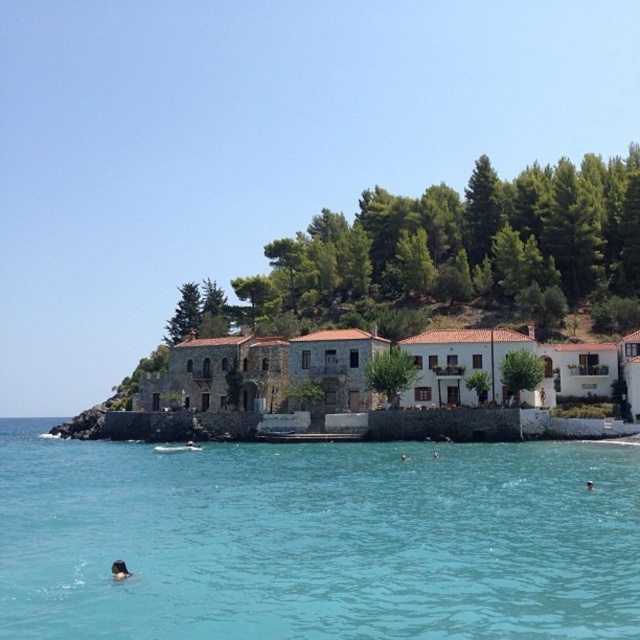
Which is above, black matte person at lower left or brown hair at lower center?

Positioned higher is brown hair at lower center.

Does black matte person at lower left appear on the right side of brown hair at lower center?

No, black matte person at lower left is not to the right of brown hair at lower center.

This screenshot has width=640, height=640. What do you see at coordinates (120, 570) in the screenshot?
I see `black matte person at lower left` at bounding box center [120, 570].

The image size is (640, 640). Find the location of `black matte person at lower left`. black matte person at lower left is located at coordinates (120, 570).

Is point (116, 502) positioned before point (131, 572)?

No.

Is clear blue water at lower center taller than black matte person at lower left?

Correct, clear blue water at lower center is much taller as black matte person at lower left.

Is point (145, 500) positioned before point (131, 573)?

No, it is not.

At what (x,y) coordinates should I click in order to perform the action: click on clear blue water at lower center. Please return your answer as a coordinate pair (x, y). Looking at the image, I should click on (316, 540).

Between clear blue water at lower center and brown hair at lower center, which one appears on the left side from the viewer's perspective?

clear blue water at lower center

Who is more forward, [248,454] or [588,488]?

Point [588,488] is in front.

This screenshot has height=640, width=640. I want to click on clear blue water at lower center, so click(x=316, y=540).